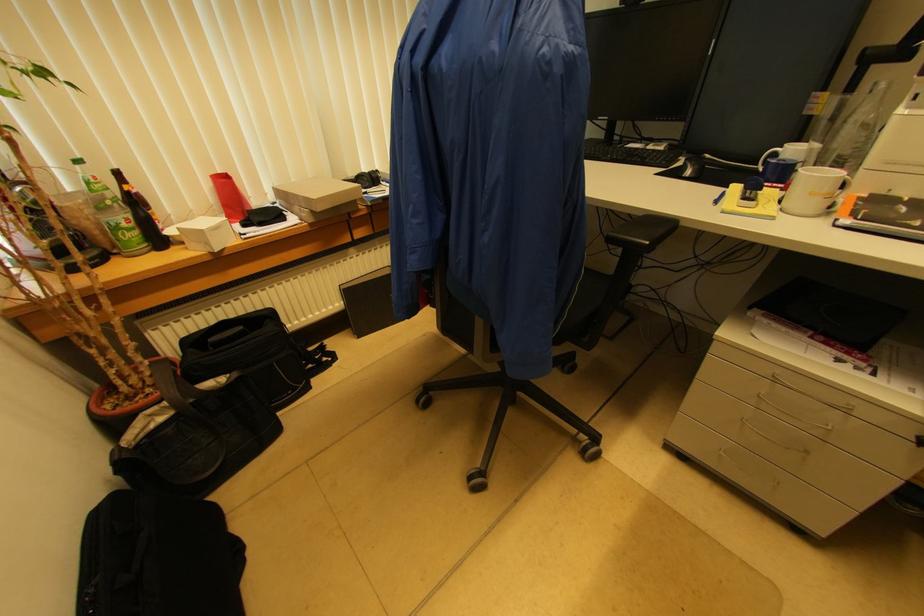
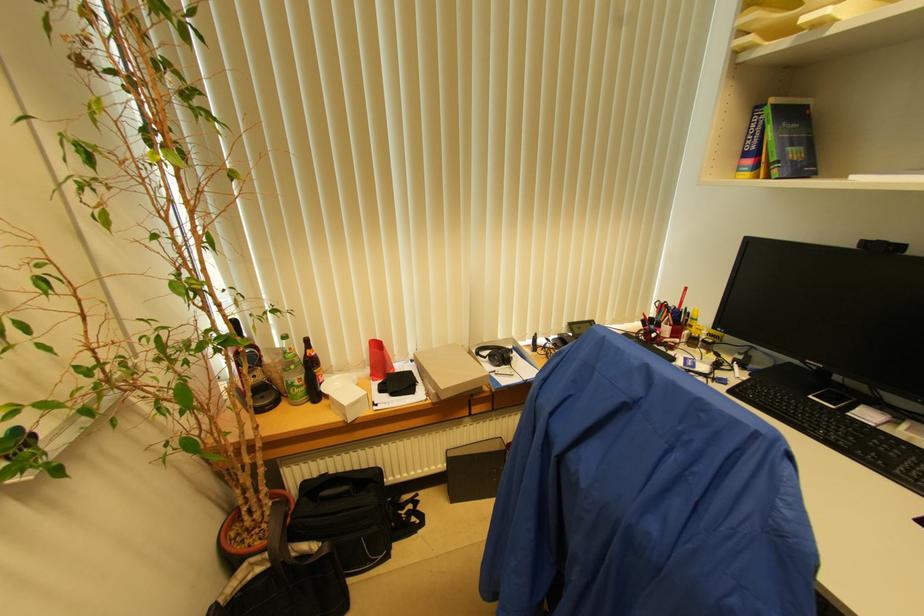
Find the pixel in the second image that matches pixel 131 219 in the first image.

(304, 379)